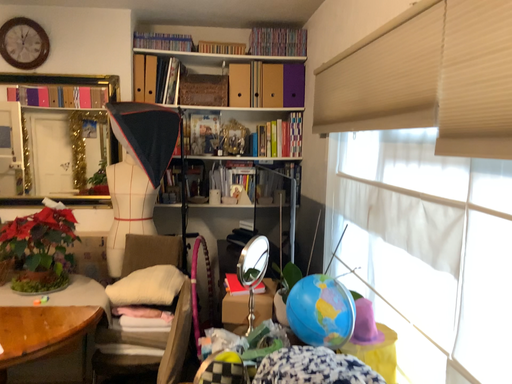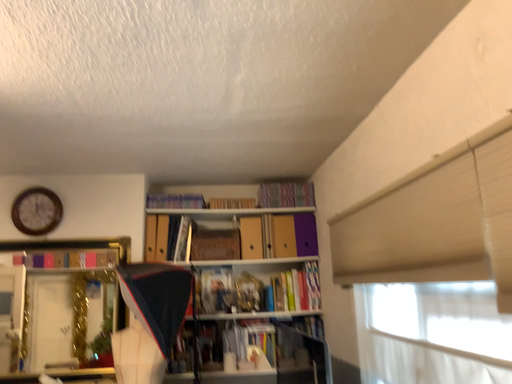
Question: How did the camera likely rotate when shooting the video?

Choices:
 (A) rotated downward
 (B) rotated upward

Answer: (B)